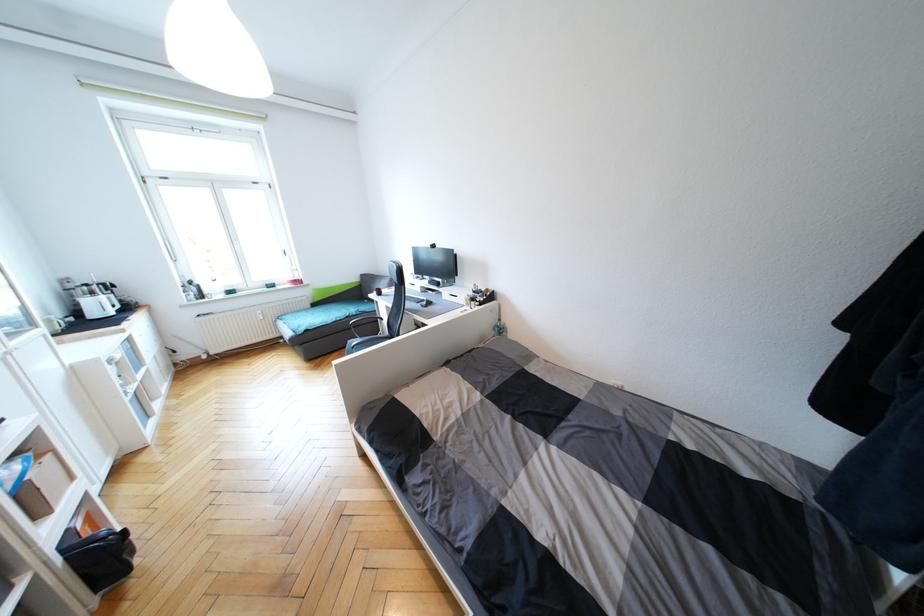
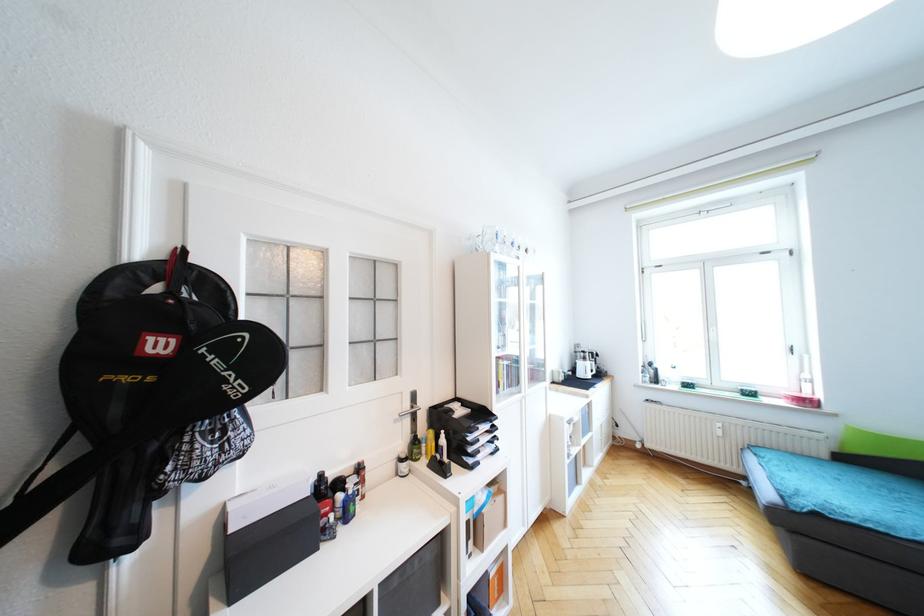
Question: The first image is from the beginning of the video and the second image is from the end. How did the camera likely rotate when shooting the video?

Choices:
 (A) Left
 (B) Right
 (C) Up
 (D) Down

Answer: (A)